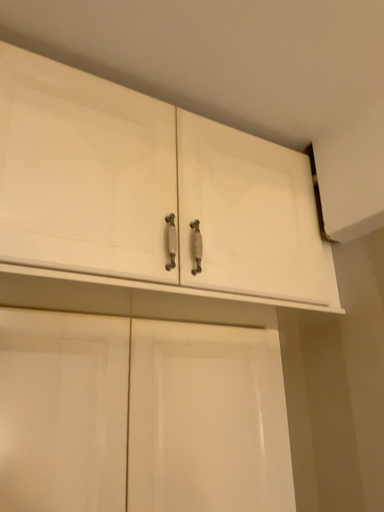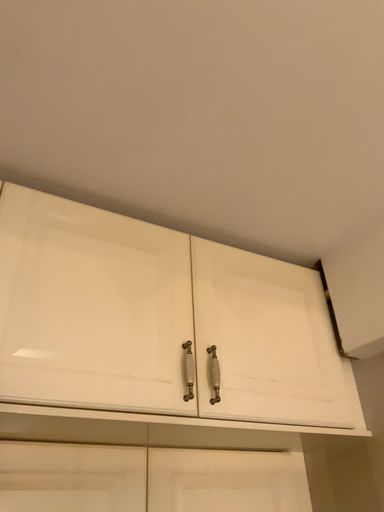
Question: How did the camera likely rotate when shooting the video?

Choices:
 (A) rotated upward
 (B) rotated downward

Answer: (A)